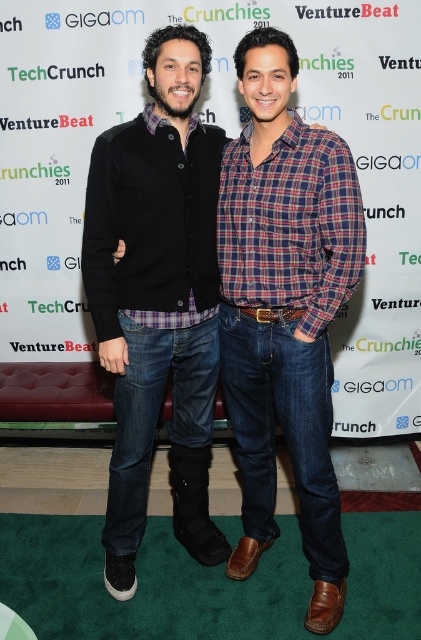
You are at a tech event and need to find the person wearing the plaid cotton shirt at center and the black matte sweater at center. According to the scene description, which one is positioned to the right?

The plaid cotton shirt at center is to the right of the black matte sweater at center.